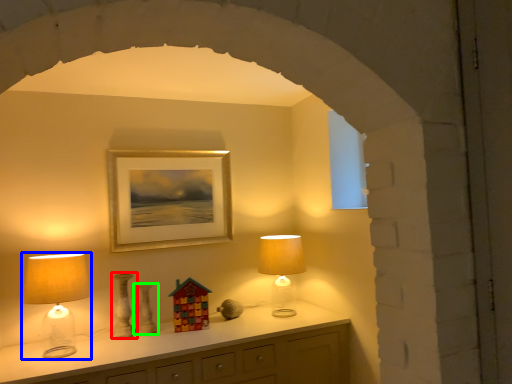
Question: Which is nearer to the vase (highlighted by a red box)? lamp (highlighted by a blue box) or vase (highlighted by a green box).

Choices:
 (A) lamp
 (B) vase

Answer: (B)